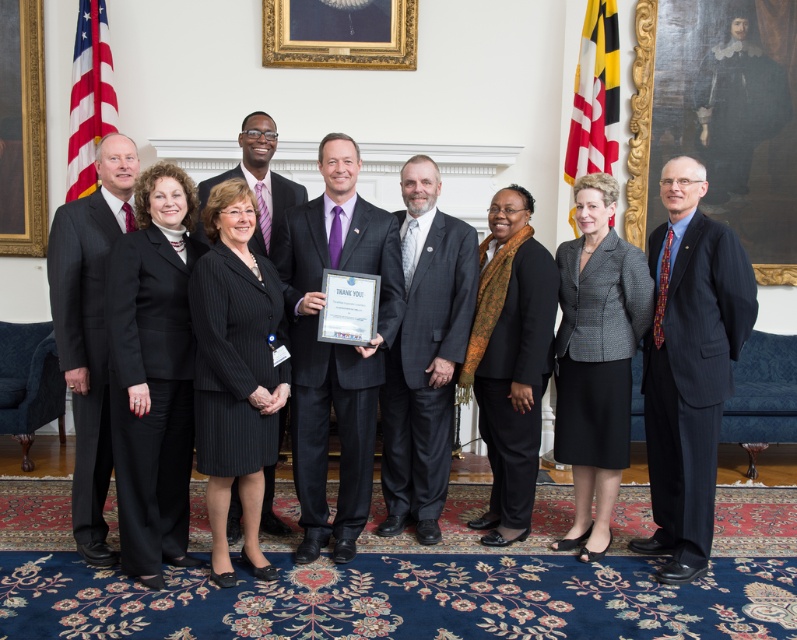
Question: Which object is farther from the camera taking this photo?

Choices:
 (A) wooden portrait frame at upper right
 (B) black houndstooth blazer at center
 (C) red fabric flag at upper right

Answer: (A)

Question: Is black houndstooth blazer at center further to the viewer compared to wooden picture frame at upper left?

Choices:
 (A) yes
 (B) no

Answer: (B)

Question: Can you confirm if dark blue pinstripe suit at right is positioned to the left of red fabric flag at upper right?

Choices:
 (A) no
 (B) yes

Answer: (A)

Question: Among these points, which one is farthest from the camera?

Choices:
 (A) (591, 65)
 (B) (792, 268)
 (C) (210, 435)

Answer: (B)

Question: Does black pinstripe suit at center have a smaller size compared to dark gray suit at center?

Choices:
 (A) yes
 (B) no

Answer: (A)

Question: Estimate the real-world distances between objects in this image. Which object is farther from the black wool scarf at center?

Choices:
 (A) wooden picture frame at upper left
 (B) black matte suit at center
 (C) matte black suit at left
 (D) matte purple tie at center

Answer: (A)